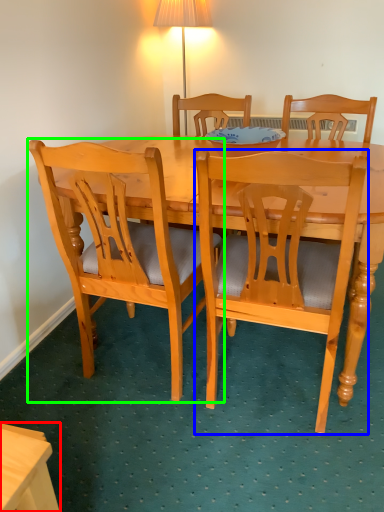
Question: Estimate the real-world distances between objects in this image. Which object is closer to desk (highlighted by a red box), chair (highlighted by a blue box) or chair (highlighted by a green box)?

Choices:
 (A) chair
 (B) chair

Answer: (B)